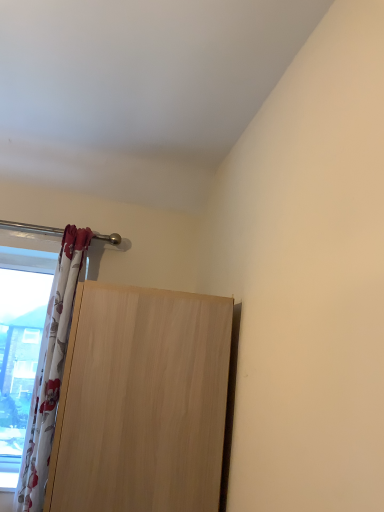
Question: Does light wood door at lower left have a lesser height compared to white floral fabric curtain at left?

Choices:
 (A) no
 (B) yes

Answer: (B)

Question: From a real-world perspective, is light wood door at lower left on white floral fabric curtain at left?

Choices:
 (A) yes
 (B) no

Answer: (B)

Question: Does light wood door at lower left appear on the left side of white floral fabric curtain at left?

Choices:
 (A) no
 (B) yes

Answer: (A)

Question: From a real-world perspective, is light wood door at lower left under white floral fabric curtain at left?

Choices:
 (A) no
 (B) yes

Answer: (B)

Question: Does light wood door at lower left lie in front of white floral fabric curtain at left?

Choices:
 (A) no
 (B) yes

Answer: (B)

Question: Is light wood door at lower left positioned beyond the bounds of white floral fabric curtain at left?

Choices:
 (A) yes
 (B) no

Answer: (A)

Question: From the image's perspective, does white floral fabric curtain at left appear higher than light wood door at lower left?

Choices:
 (A) yes
 (B) no

Answer: (A)

Question: Does white floral fabric curtain at left have a greater height compared to light wood door at lower left?

Choices:
 (A) no
 (B) yes

Answer: (B)

Question: From the image's perspective, does white floral fabric curtain at left appear lower than light wood door at lower left?

Choices:
 (A) no
 (B) yes

Answer: (A)

Question: Is the position of white floral fabric curtain at left less distant than that of light wood door at lower left?

Choices:
 (A) no
 (B) yes

Answer: (A)

Question: Are white floral fabric curtain at left and light wood door at lower left located far from each other?

Choices:
 (A) no
 (B) yes

Answer: (A)

Question: Are white floral fabric curtain at left and light wood door at lower left beside each other?

Choices:
 (A) no
 (B) yes

Answer: (A)

Question: From their relative heights in the image, would you say white floral fabric curtain at left is taller or shorter than light wood door at lower left?

Choices:
 (A) tall
 (B) short

Answer: (A)